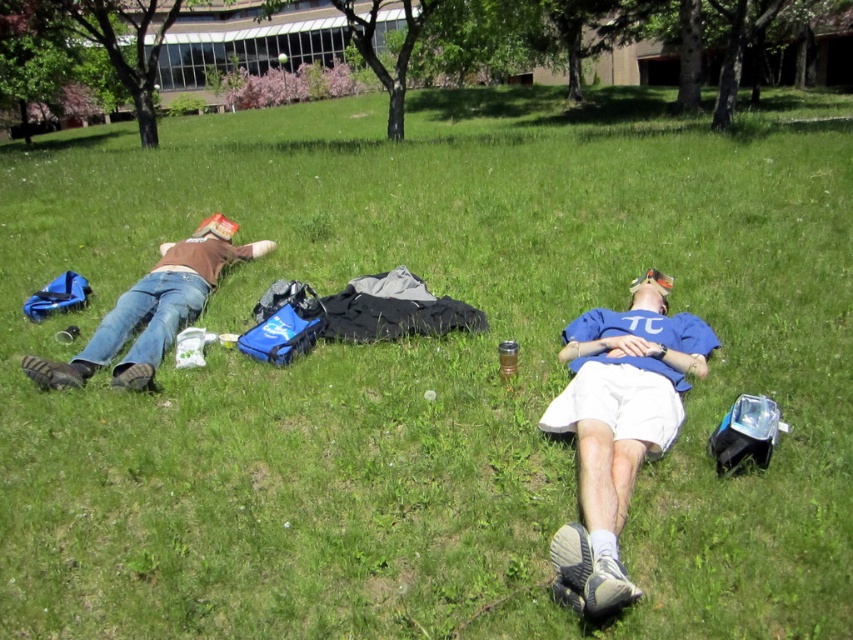
You are organizing a clothing donation drive and need to categorize shirts based on size. You have two shirts in front of you, the blue cotton shirt at center and the brown matte shirt at left. Which shirt should you place in the large size bin?

The blue cotton shirt at center is bigger than the brown matte shirt at left, so it should be placed in the large size bin.